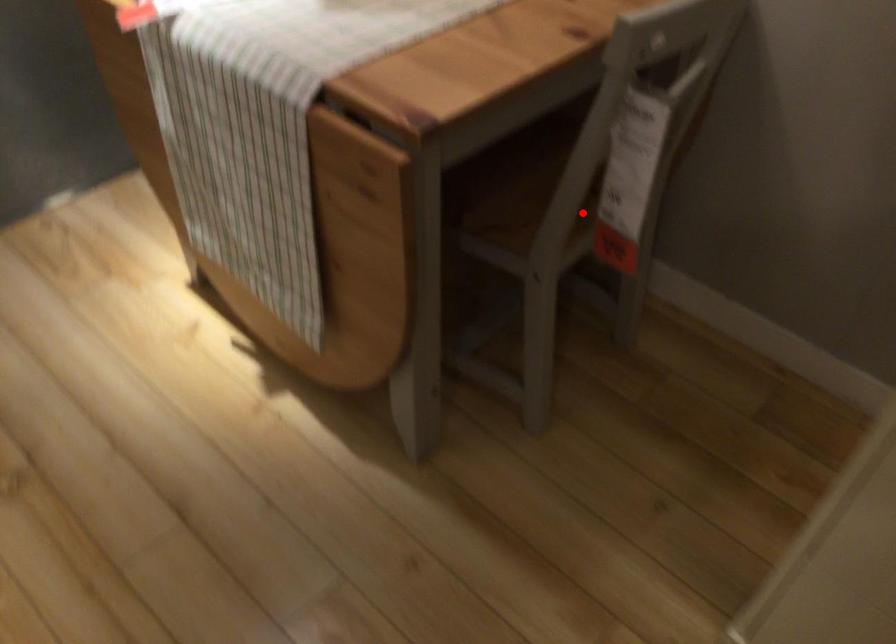
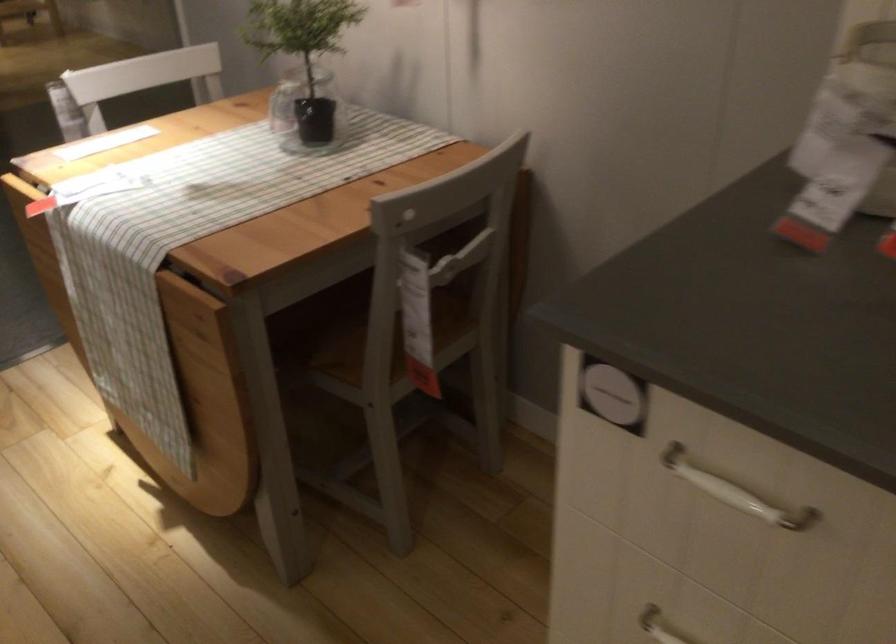
Question: I am providing you with two images of the same scene from different viewpoints. Image1 has a red point marked. In image2, the corresponding 3D location appears at what relative position? Reply with the corresponding letter.

Choices:
 (A) Closer
 (B) Farther

Answer: (B)